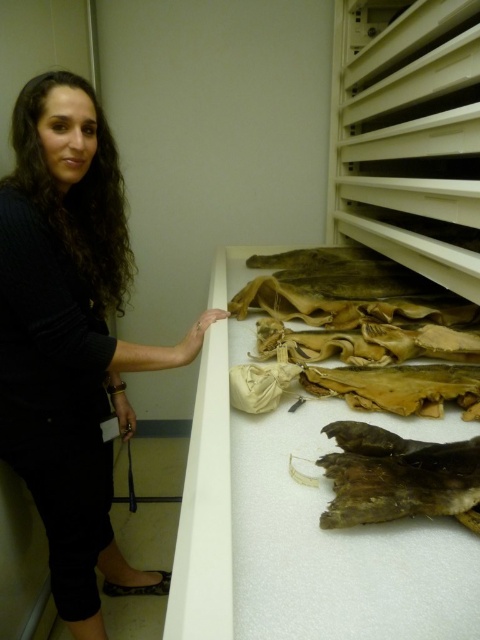
You are a visitor in a museum and see the black sweater at left and the brown leather animal at lower right. Which object is closer to you?

The black sweater at left is closer to you because it is further to the viewer than the brown leather animal at lower right.

You are a visitor at a museum and you see the brown leather bag at upper right and the black sweater at left. Which object is wider?

The brown leather bag at upper right is wider than the black sweater at left because its width surpasses the black sweater at left.